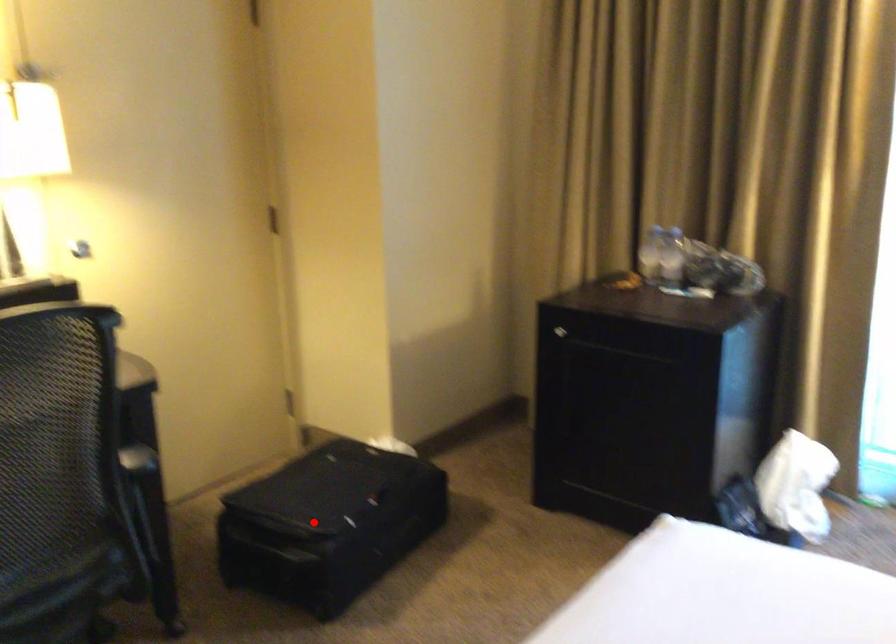
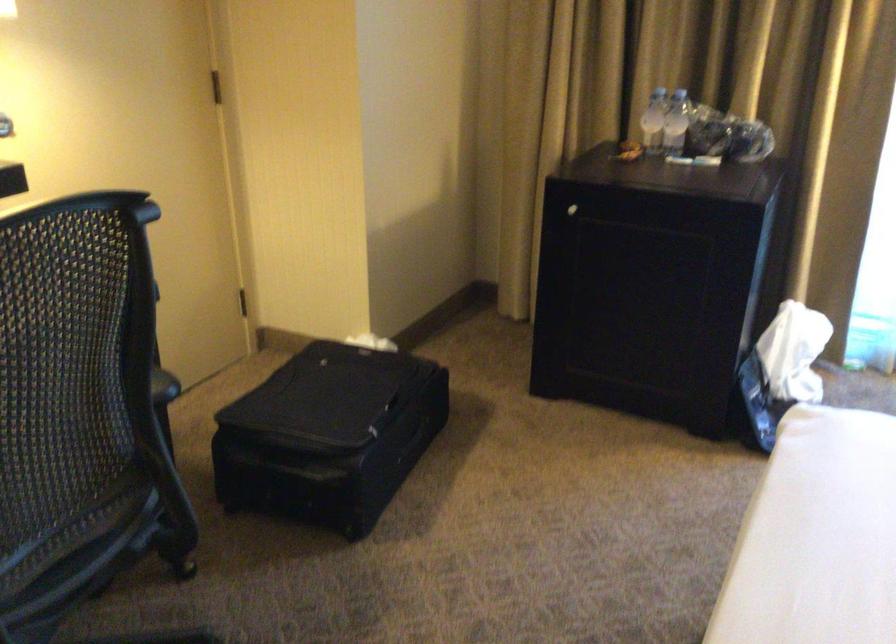
Question: I am providing you with two images of the same scene from different viewpoints. A red point is shown in image1. For the corresponding object point in image2, is it positioned nearer or farther from the camera?

Choices:
 (A) Nearer
 (B) Farther

Answer: (A)